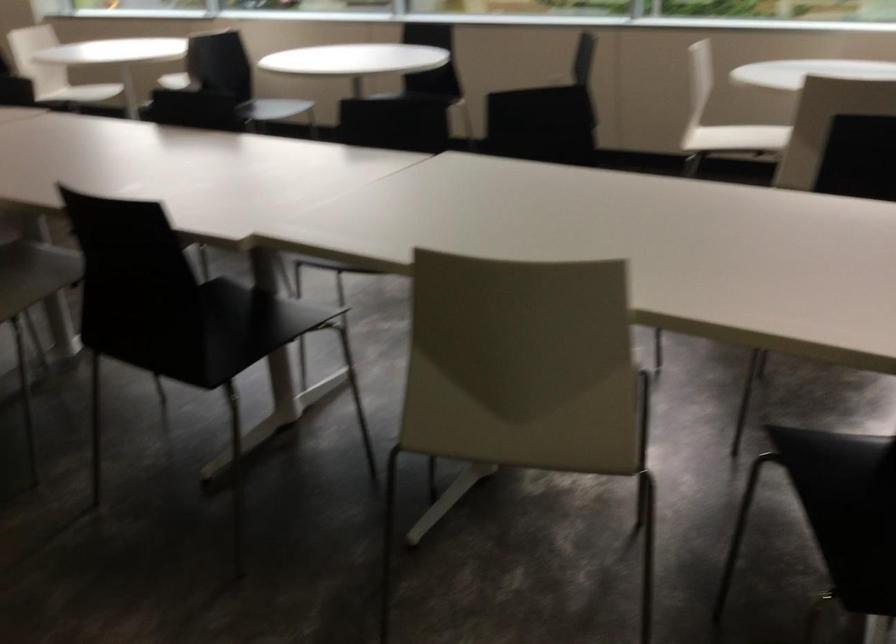
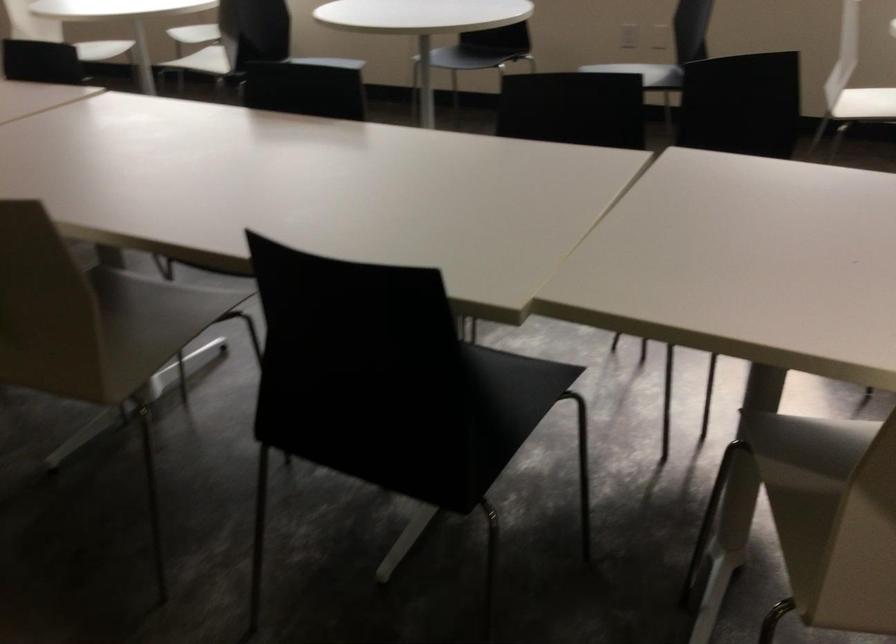
Which direction would the cameraman need to move to produce the second image?

The movement direction of the cameraman is left, forward.